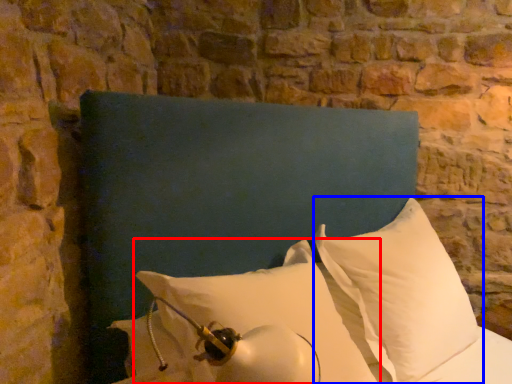
Question: Which object is closer to the camera taking this photo, pillow (highlighted by a red box) or pillow (highlighted by a blue box)?

Choices:
 (A) pillow
 (B) pillow

Answer: (A)